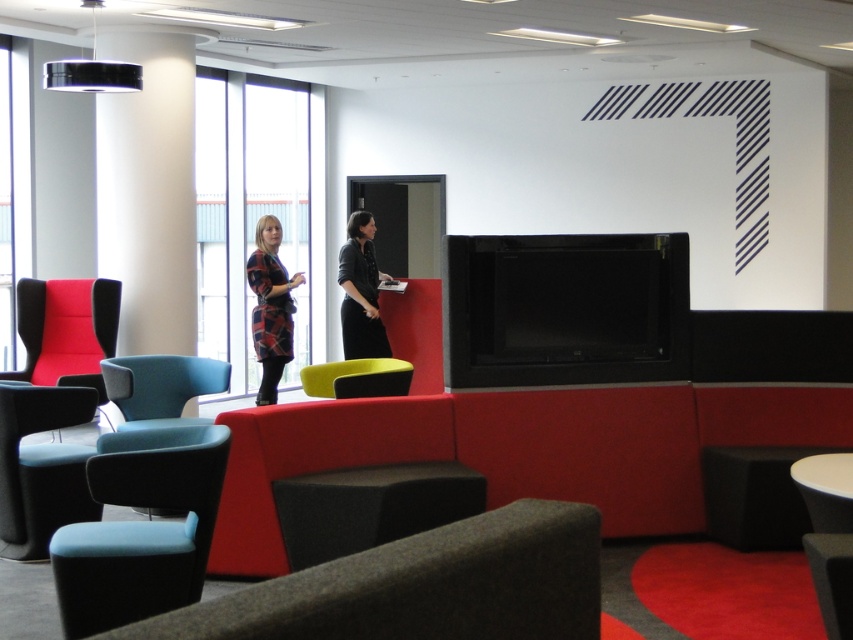
Is plaid fabric shirt at center positioned in front of black leather jacket at center?

Yes, plaid fabric shirt at center is in front of black leather jacket at center.

Identify the location of plaid fabric shirt at center. (270, 307).

The width and height of the screenshot is (853, 640). What are the coordinates of `plaid fabric shirt at center` in the screenshot? It's located at (270, 307).

Where is `plaid fabric shirt at center`? plaid fabric shirt at center is located at coordinates (270, 307).

Who is shorter, teal fabric chair at center or yellow fabric chair at center?

yellow fabric chair at center is shorter.

I want to click on teal fabric chair at center, so click(160, 387).

Does teal fabric chair at center appear over black leather jacket at center?

No.

Which is behind, point (120, 376) or point (346, 268)?

Positioned behind is point (346, 268).

Locate an element on the screen. teal fabric chair at center is located at coordinates (160, 387).